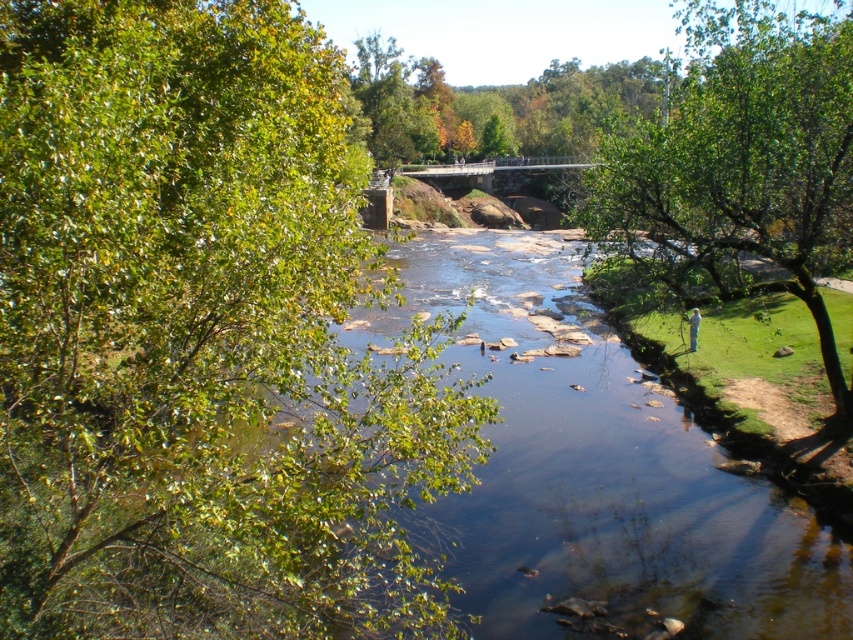
Question: Among these objects, which one is nearest to the camera?

Choices:
 (A) green leafy tree at left
 (B) green leafy tree at lower right

Answer: (A)

Question: Does green leafy tree at left appear over green leafy tree at lower right?

Choices:
 (A) yes
 (B) no

Answer: (B)

Question: Which point is closer to the camera taking this photo?

Choices:
 (A) (753, 195)
 (B) (281, 404)

Answer: (A)

Question: Can you confirm if green leafy tree at left is positioned below green leafy tree at lower right?

Choices:
 (A) no
 (B) yes

Answer: (B)

Question: Which point is closer to the camera?

Choices:
 (A) (126, 74)
 (B) (660, 156)

Answer: (A)

Question: Does green leafy tree at left appear on the left side of green leafy tree at lower right?

Choices:
 (A) no
 (B) yes

Answer: (B)